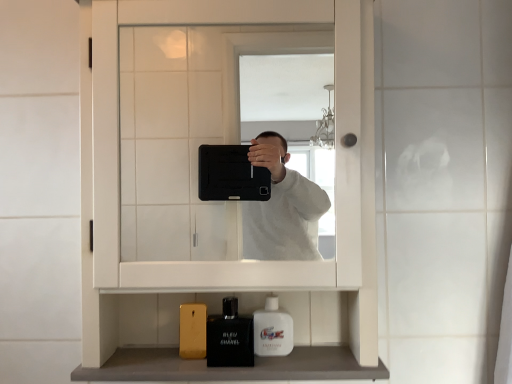
Question: Is matte black perfume at lower center far from white glossy mouthwash at lower center?

Choices:
 (A) no
 (B) yes

Answer: (A)

Question: Is matte black perfume at lower center facing towards white glossy mouthwash at lower center?

Choices:
 (A) no
 (B) yes

Answer: (A)

Question: Does matte black perfume at lower center lie behind white glossy mouthwash at lower center?

Choices:
 (A) yes
 (B) no

Answer: (B)

Question: Is the position of matte black perfume at lower center less distant than that of white glossy mouthwash at lower center?

Choices:
 (A) no
 (B) yes

Answer: (B)

Question: Can you confirm if matte black perfume at lower center is smaller than white glossy mouthwash at lower center?

Choices:
 (A) yes
 (B) no

Answer: (B)

Question: Is white glossy mouthwash at lower center located within matte black perfume at lower center?

Choices:
 (A) no
 (B) yes

Answer: (A)

Question: Is white glossy mouthwash at lower center bigger than smooth gray countertop at lower center?

Choices:
 (A) yes
 (B) no

Answer: (B)

Question: From the image's perspective, is white glossy mouthwash at lower center located above smooth gray countertop at lower center?

Choices:
 (A) no
 (B) yes

Answer: (B)

Question: Does white glossy mouthwash at lower center lie behind smooth gray countertop at lower center?

Choices:
 (A) no
 (B) yes

Answer: (B)

Question: Can you confirm if white glossy mouthwash at lower center is positioned to the right of smooth gray countertop at lower center?

Choices:
 (A) yes
 (B) no

Answer: (A)

Question: Is white glossy mouthwash at lower center shorter than smooth gray countertop at lower center?

Choices:
 (A) no
 (B) yes

Answer: (A)

Question: Does white glossy mouthwash at lower center turn towards smooth gray countertop at lower center?

Choices:
 (A) no
 (B) yes

Answer: (A)

Question: From a real-world perspective, does white glossy mouthwash at lower center sit lower than matte black perfume at lower center?

Choices:
 (A) no
 (B) yes

Answer: (A)